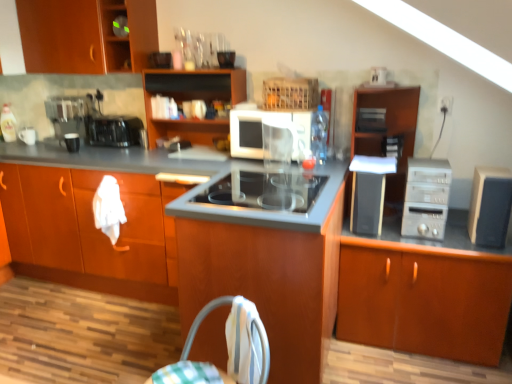
Locate an element on the screen. Image resolution: width=512 pixels, height=384 pixels. vacant region to the left of white glossy mug at left, placed as the first appliance when sorted from left to right is located at coordinates [x=12, y=144].